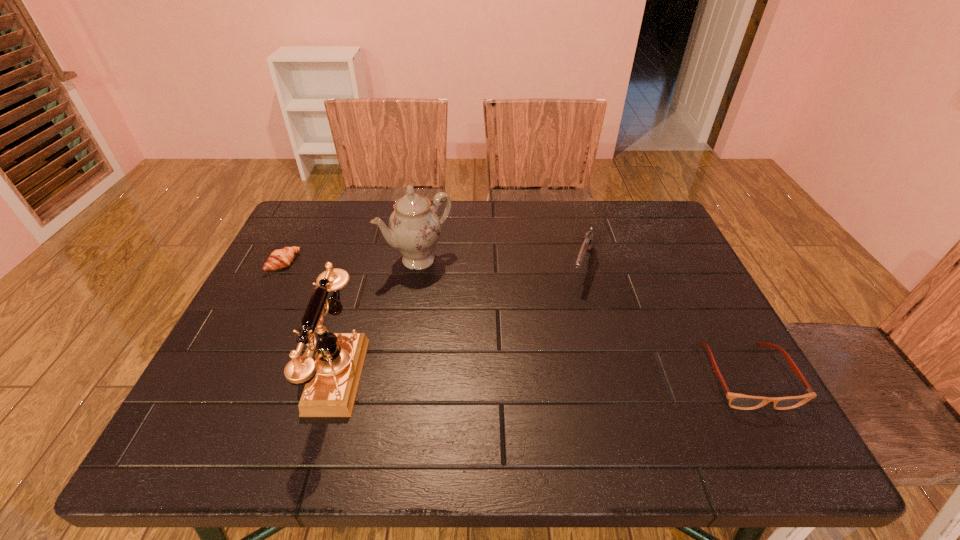
You are a GUI agent. You are given a task and a screenshot of the screen. Output one action in this format:
    pyautogui.click(x=<x>, y=<y>)
    Task: Click on the vacant space located on the spout of the chinaware
    The image size is (960, 540).
    Given the screenshot: What is the action you would take?
    pyautogui.click(x=456, y=292)

The height and width of the screenshot is (540, 960). Find the location of `free spot located 0.240m on the spout of the chinaware`. free spot located 0.240m on the spout of the chinaware is located at coordinates (492, 328).

Locate an element on the screen. Image resolution: width=960 pixels, height=540 pixels. vacant point located on the spout of the chinaware is located at coordinates (516, 353).

This screenshot has width=960, height=540. In order to click on vacant area situated 0.320m on the front-facing side of the leftmost object in this screenshot , I will do `click(380, 318)`.

The width and height of the screenshot is (960, 540). I want to click on vacant space positioned on the front-facing side of the leftmost object, so click(x=406, y=332).

Image resolution: width=960 pixels, height=540 pixels. Find the location of `vacant region located on the front-facing side of the leftmost object`. vacant region located on the front-facing side of the leftmost object is located at coordinates coord(304,277).

The height and width of the screenshot is (540, 960). I want to click on free location located aiming along the barrel of the third tallest object, so click(557, 362).

Where is `vacant space located 0.170m aiming along the barrel of the third tallest object`? Image resolution: width=960 pixels, height=540 pixels. vacant space located 0.170m aiming along the barrel of the third tallest object is located at coordinates (565, 336).

What are the coordinates of `blank space located aiming along the barrel of the third tallest object` in the screenshot? It's located at (571, 318).

The image size is (960, 540). I want to click on chinaware situated at the far edge, so click(x=414, y=228).